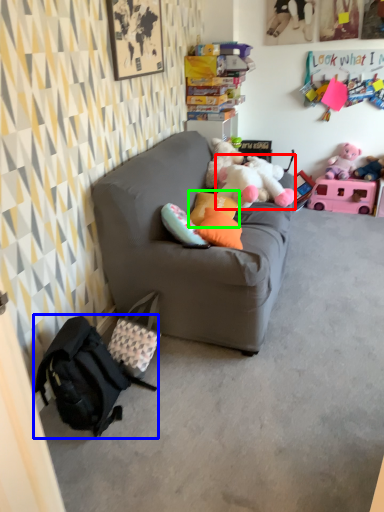
Question: Which object is the closest to the toy (highlighted by a red box)? Choose among these: backpack (highlighted by a blue box) or pillow (highlighted by a green box).

Choices:
 (A) backpack
 (B) pillow

Answer: (B)